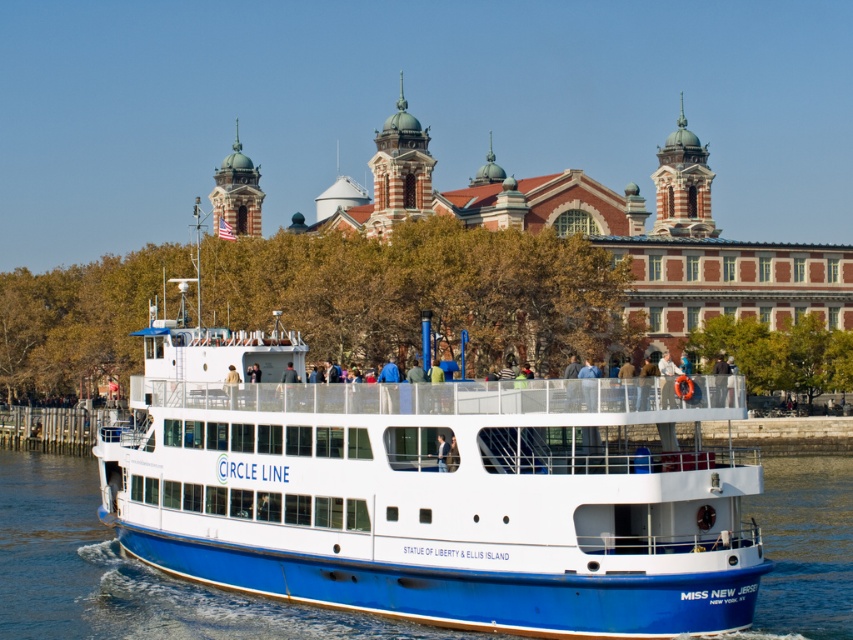
You are standing on a dock and see the blue matte ferry at center. If you want to take a photo of the ferry with your camera, which is 1.5 meters long, will the ferry fit in the frame if you hold the camera horizontally?

The blue matte ferry at center is 53.46 meters away from the camera. Since the ferry is much farther away than the camera length, it will easily fit within the frame when holding the camera horizontally.

Consider the image. You are standing on the ferry boat named Circle Line and want to reach a specific point marked at coordinates point [547,572]. If your current position is 100 feet away from that point, can you safely walk towards it without needing to cross any obstacles?

The distance of point [547,572] from viewer is 180.56 feet. Since you are currently 100 feet away from it, you still need to cover an additional 80.56 feet to reach the point. However, the question does not mention any obstacles between your current position and the point, so assuming there are no obstacles, you can safely walk towards it.